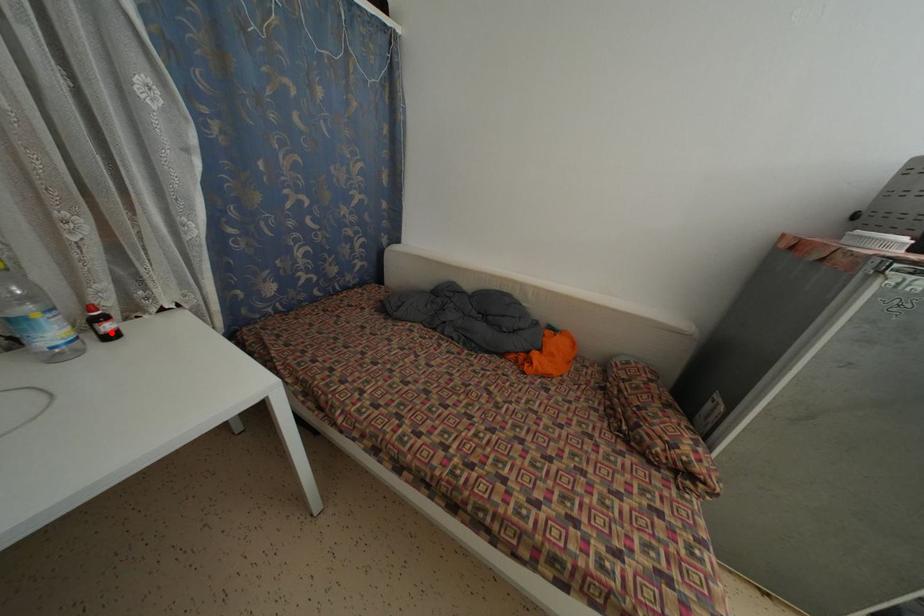
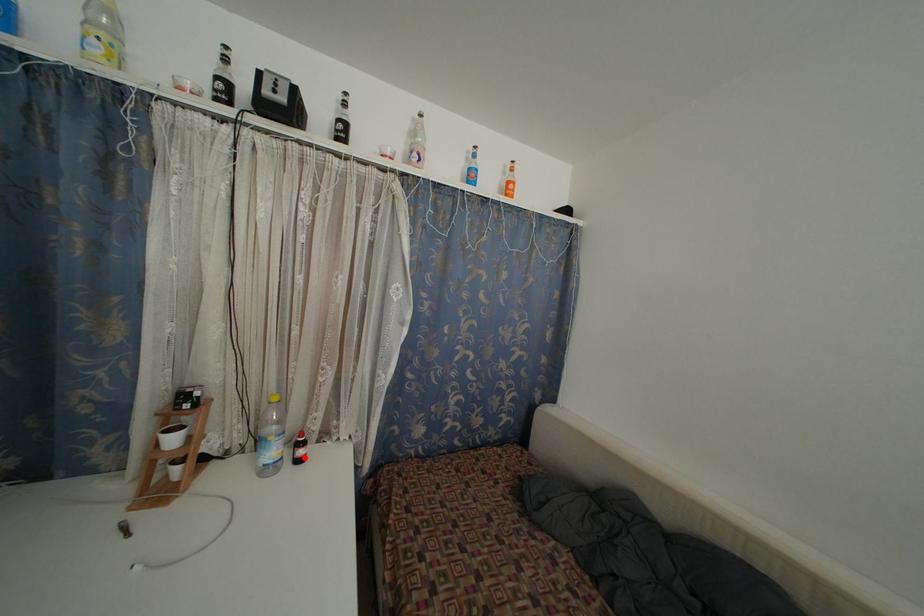
I am providing you with two images of the same scene from different viewpoints. A red point is marked on the first image and another point is marked on the second image. Does the point marked in image1 correspond to the same location as the one in image2?

Yes